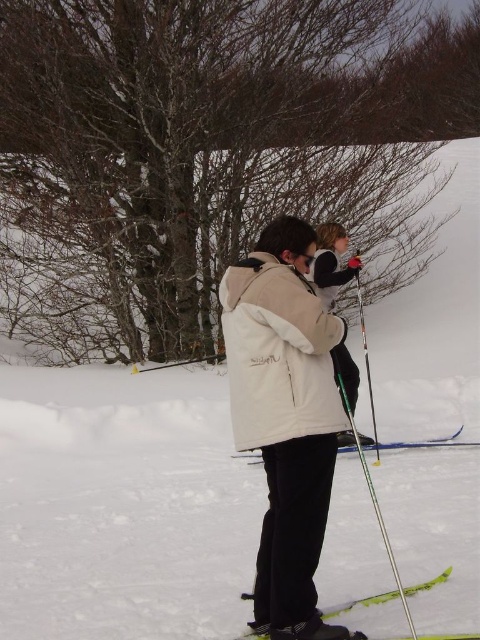
Is white fleece jacket at center bigger than green glossy ski at lower center?

Yes.

The image size is (480, 640). Describe the element at coordinates (331, 262) in the screenshot. I see `white fleece jacket at center` at that location.

Who is more distant from viewer, [352,257] or [337,605]?

The point [352,257] is more distant.

Where is `white fleece jacket at center`? Image resolution: width=480 pixels, height=640 pixels. white fleece jacket at center is located at coordinates tap(331, 262).

Between green plastic ski pole at center and green glossy ski at lower center, which one has more height?

green plastic ski pole at center

Looking at this image, can you confirm if green plastic ski pole at center is positioned below green glossy ski at lower center?

No.

At what (x,y) coordinates should I click in order to perform the action: click on green plastic ski pole at center. Please return your answer as a coordinate pair (x, y). Looking at the image, I should click on (384, 531).

Locate an element on the screen. Image resolution: width=480 pixels, height=640 pixels. green plastic ski pole at center is located at coordinates (384, 531).

Which of these two, green glossy ski at lower center or blue plastic ski at center, stands taller?

With more height is blue plastic ski at center.

Between green glossy ski at lower center and blue plastic ski at center, which one is positioned lower?

green glossy ski at lower center

Is point (437, 576) closer to camera compared to point (457, 432)?

Yes, point (437, 576) is closer to viewer.

What are the coordinates of `green glossy ski at lower center` in the screenshot? It's located at pyautogui.click(x=360, y=604).